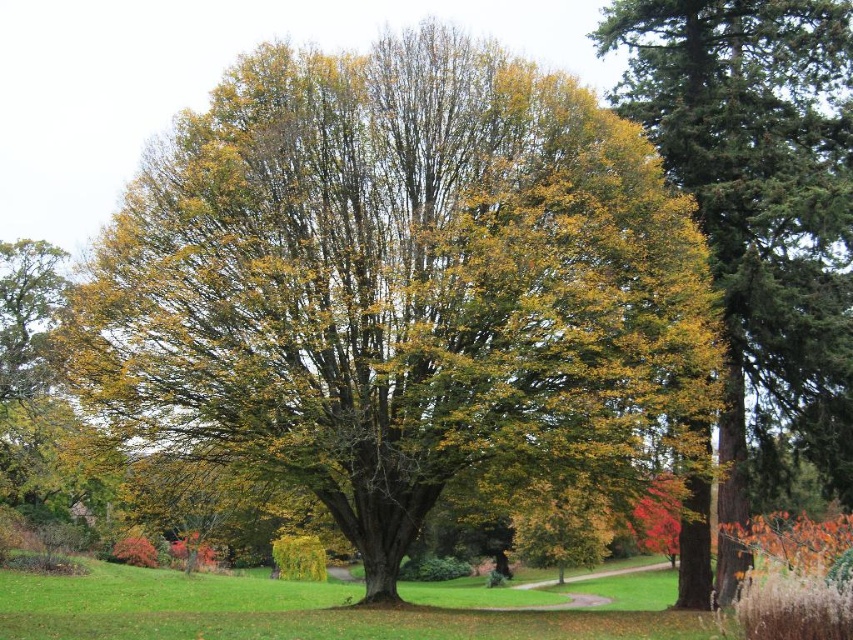
Question: Which object appears closest to the camera in this image?

Choices:
 (A) green leafy tree at center
 (B) green textured tree at right

Answer: (A)

Question: Does green leafy tree at center appear on the right side of green textured tree at right?

Choices:
 (A) no
 (B) yes

Answer: (A)

Question: Does green leafy tree at center lie in front of green textured tree at right?

Choices:
 (A) yes
 (B) no

Answer: (A)

Question: Can you confirm if green leafy tree at center is positioned below green textured tree at right?

Choices:
 (A) no
 (B) yes

Answer: (B)

Question: Which point is closer to the camera?

Choices:
 (A) green leafy tree at center
 (B) green textured tree at right

Answer: (A)